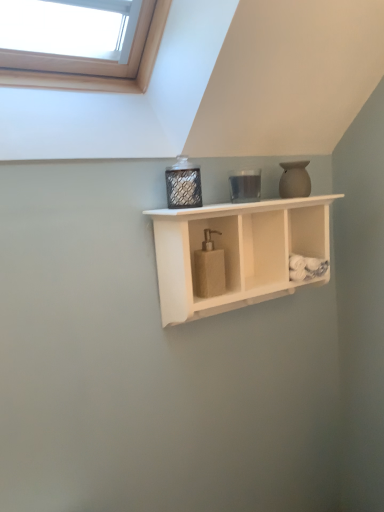
This screenshot has height=512, width=384. I want to click on vacant point to the right of metallic mesh container at center, so click(231, 205).